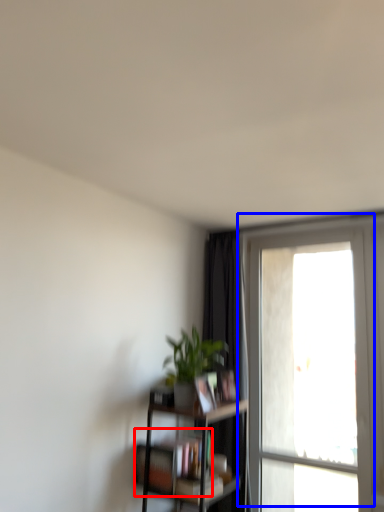
Question: Which point is further to the camera, book (highlighted by a red box) or window (highlighted by a blue box)?

Choices:
 (A) book
 (B) window

Answer: (B)